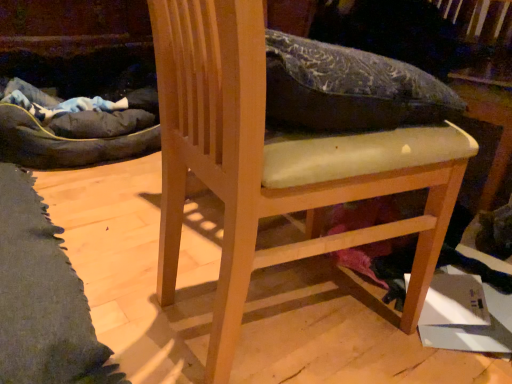
Question: Considering the relative sizes of white cardboard box at lower right and light wood chair at center in the image provided, is white cardboard box at lower right bigger than light wood chair at center?

Choices:
 (A) yes
 (B) no

Answer: (B)

Question: From the image's perspective, would you say white cardboard box at lower right is shown under light wood chair at center?

Choices:
 (A) yes
 (B) no

Answer: (A)

Question: Is white cardboard box at lower right far from light wood chair at center?

Choices:
 (A) yes
 (B) no

Answer: (B)

Question: Is white cardboard box at lower right further to the viewer compared to light wood chair at center?

Choices:
 (A) no
 (B) yes

Answer: (B)

Question: Considering the relative sizes of white cardboard box at lower right and light wood chair at center in the image provided, is white cardboard box at lower right thinner than light wood chair at center?

Choices:
 (A) yes
 (B) no

Answer: (A)

Question: Considering the relative sizes of white cardboard box at lower right and light wood chair at center in the image provided, is white cardboard box at lower right smaller than light wood chair at center?

Choices:
 (A) no
 (B) yes

Answer: (B)

Question: Does light wood chair at center come behind white cardboard box at lower right?

Choices:
 (A) no
 (B) yes

Answer: (A)

Question: From a real-world perspective, is light wood chair at center located higher than white cardboard box at lower right?

Choices:
 (A) yes
 (B) no

Answer: (A)

Question: Considering the relative sizes of light wood chair at center and white cardboard box at lower right in the image provided, is light wood chair at center shorter than white cardboard box at lower right?

Choices:
 (A) yes
 (B) no

Answer: (B)

Question: Can we say light wood chair at center lies outside white cardboard box at lower right?

Choices:
 (A) yes
 (B) no

Answer: (A)

Question: Can you confirm if light wood chair at center is positioned to the right of white cardboard box at lower right?

Choices:
 (A) yes
 (B) no

Answer: (B)

Question: From a real-world perspective, is light wood chair at center physically below white cardboard box at lower right?

Choices:
 (A) yes
 (B) no

Answer: (B)

Question: Is light wood chair at center spatially inside white cardboard box at lower right, or outside of it?

Choices:
 (A) inside
 (B) outside

Answer: (B)